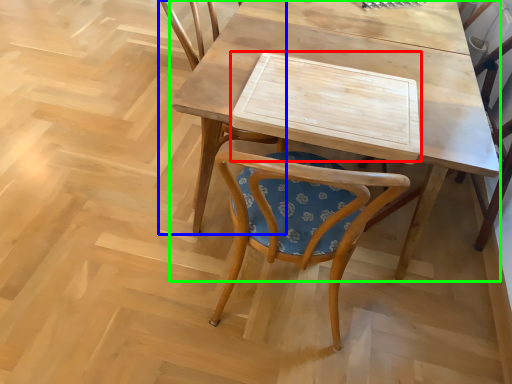
Question: Which object is positioned closest to plank (highlighted by a red box)? Select from chair (highlighted by a blue box) and table (highlighted by a green box).

Choices:
 (A) chair
 (B) table

Answer: (B)